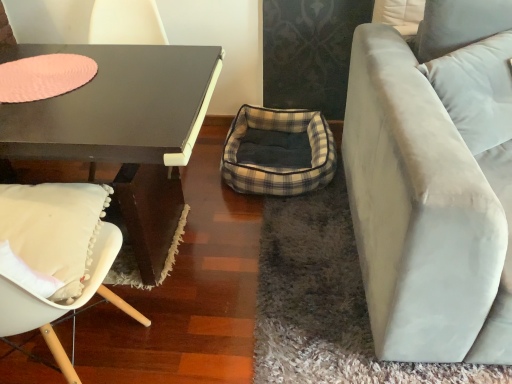
Image resolution: width=512 pixels, height=384 pixels. I want to click on vacant area that lies in front of plaid fabric bean bag at center, so click(264, 244).